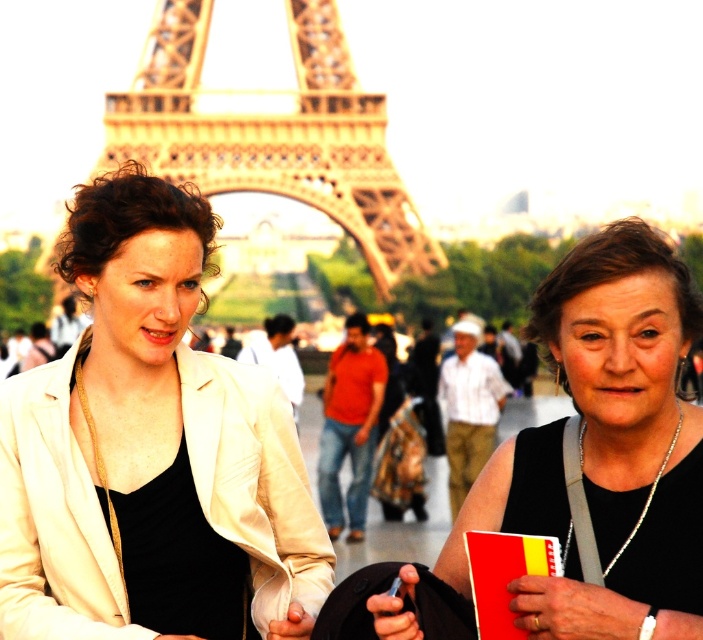
Question: Can you confirm if black matte dress at center is positioned to the right of golden metallic eiffel tower at center?

Choices:
 (A) yes
 (B) no

Answer: (A)

Question: Can you confirm if matte white jacket at center is wider than golden metallic eiffel tower at center?

Choices:
 (A) yes
 (B) no

Answer: (B)

Question: Estimate the real-world distances between objects in this image. Which object is closer to the black matte dress at center?

Choices:
 (A) golden metallic eiffel tower at center
 (B) matte white jacket at center

Answer: (B)

Question: Which object is the farthest from the matte white jacket at center?

Choices:
 (A) black matte dress at center
 (B) golden metallic eiffel tower at center

Answer: (A)

Question: Is matte white jacket at center bigger than golden metallic eiffel tower at center?

Choices:
 (A) yes
 (B) no

Answer: (B)

Question: Which point appears closest to the camera in this image?

Choices:
 (A) (344, 154)
 (B) (63, 547)

Answer: (B)